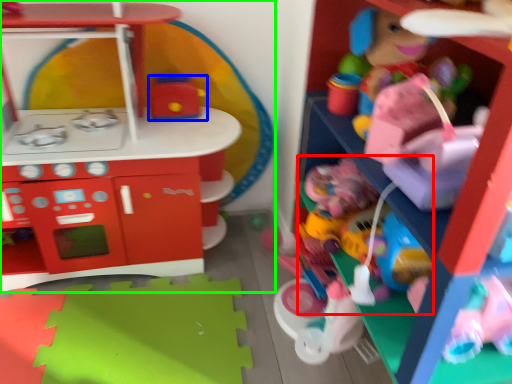
Question: Which is farther away from toy (highlighted by a red box)? toy (highlighted by a blue box) or toy (highlighted by a green box)?

Choices:
 (A) toy
 (B) toy

Answer: (B)